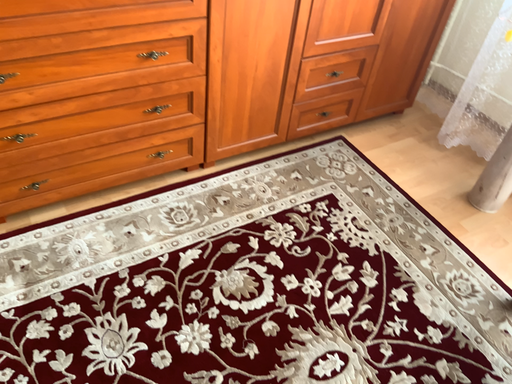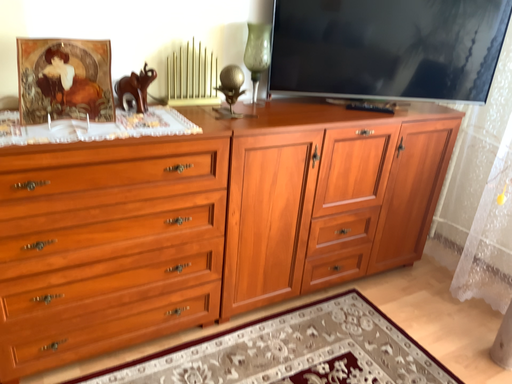
Question: How did the camera likely rotate when shooting the video?

Choices:
 (A) rotated downward
 (B) rotated upward

Answer: (B)